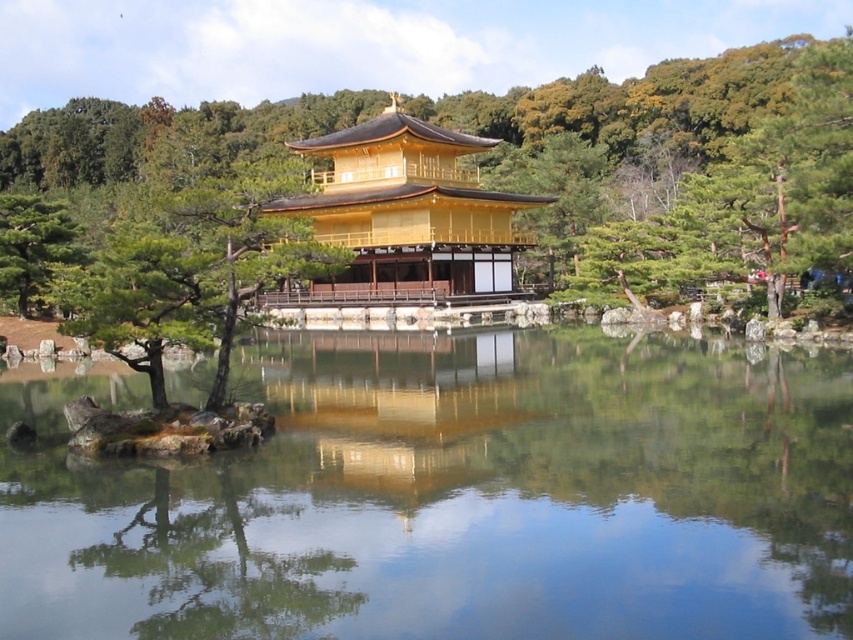
Question: Which point is farther to the camera?

Choices:
 (A) golden polished wood temple at center
 (B) green leafy tree at center

Answer: (B)

Question: Which object appears closest to the camera in this image?

Choices:
 (A) gold reflective surface at center
 (B) transparent glass water at center
 (C) golden polished wood temple at center

Answer: (B)

Question: Can you confirm if golden polished wood temple at center is positioned to the right of green matte tree at center-left?

Choices:
 (A) no
 (B) yes

Answer: (B)

Question: Does green leafy tree at center appear over green matte tree at center-left?

Choices:
 (A) no
 (B) yes

Answer: (B)

Question: Among these points, which one is nearest to the camera?

Choices:
 (A) (38, 298)
 (B) (519, 440)
 (C) (456, 433)
 (D) (281, 136)

Answer: (B)

Question: Can you confirm if transparent glass water at center is positioned above green leafy tree at center?

Choices:
 (A) yes
 (B) no

Answer: (B)